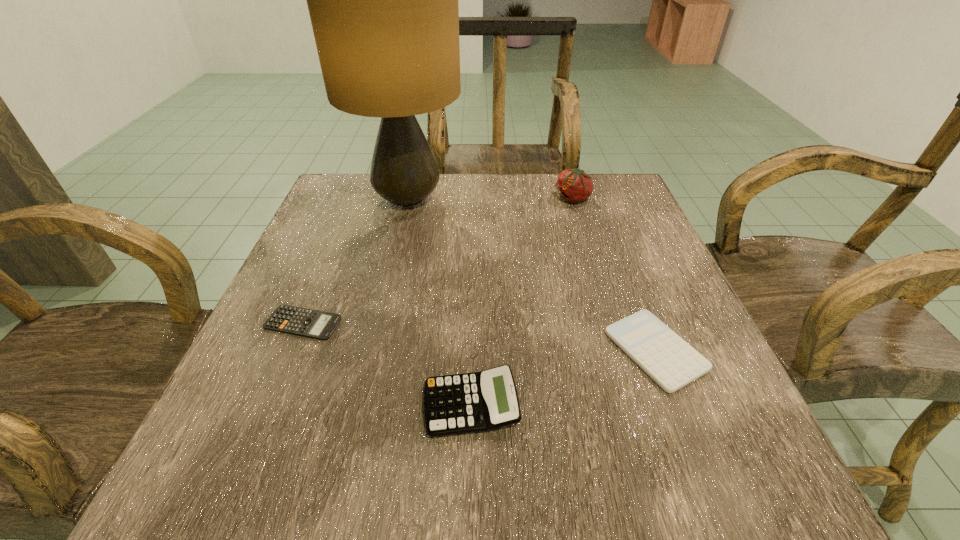
You are a GUI agent. You are given a task and a screenshot of the screen. Output one action in this format:
    pyautogui.click(x=<x>, y=<y>)
    Task: Click on the object that is the closest to the rightmost calculator
    This screenshot has width=960, height=540.
    Given the screenshot: What is the action you would take?
    pyautogui.click(x=481, y=401)

Identify which calculator is located as the third nearest to the tomato. Please provide its 2D coordinates. Your answer should be formatted as a tuple, i.e. [(x, y)], where the tuple contains the x and y coordinates of a point satisfying the conditions above.

[(294, 320)]

Identify which calculator is located as the second nearest to the leftmost calculator. Please provide its 2D coordinates. Your answer should be formatted as a tuple, i.e. [(x, y)], where the tuple contains the x and y coordinates of a point satisfying the conditions above.

[(665, 357)]

Where is `vacant area that satisfies the following two spatial constraints: 1. on the back side of the second tallest calculator; 2. on the right side of the third shortest object`? Image resolution: width=960 pixels, height=540 pixels. vacant area that satisfies the following two spatial constraints: 1. on the back side of the second tallest calculator; 2. on the right side of the third shortest object is located at coordinates pos(472,350).

At what (x,y) coordinates should I click in order to perform the action: click on vacant area in the image that satisfies the following two spatial constraints: 1. on the back side of the rightmost calculator; 2. on the right side of the second calculator from left to right. Please return your answer as a coordinate pair (x, y). This screenshot has width=960, height=540. Looking at the image, I should click on (472, 350).

What are the coordinates of `vacant space that satisfies the following two spatial constraints: 1. on the back side of the third shortest object; 2. on the left side of the second shortest calculator` in the screenshot? It's located at (472, 350).